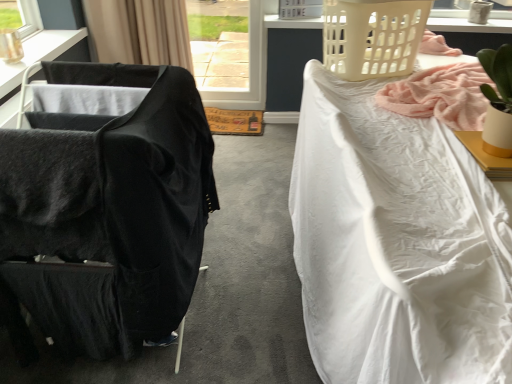
Question: Is the position of black fabric curtain at upper left more distant than that of black fabric chair at left?

Choices:
 (A) yes
 (B) no

Answer: (A)

Question: Is black fabric curtain at upper left to the right of black fabric chair at left from the viewer's perspective?

Choices:
 (A) yes
 (B) no

Answer: (B)

Question: Is black fabric chair at left a part of black fabric curtain at upper left?

Choices:
 (A) yes
 (B) no

Answer: (B)

Question: Is black fabric curtain at upper left wider than black fabric chair at left?

Choices:
 (A) no
 (B) yes

Answer: (A)

Question: Is black fabric curtain at upper left not within black fabric chair at left?

Choices:
 (A) no
 (B) yes

Answer: (B)

Question: Is point (11, 251) closer or farther from the camera than point (466, 147)?

Choices:
 (A) farther
 (B) closer

Answer: (B)

Question: Is black fabric chair at left wider or thinner than white matte desk at upper right?

Choices:
 (A) wide
 (B) thin

Answer: (A)

Question: From a real-world perspective, is black fabric chair at left positioned above or below white matte desk at upper right?

Choices:
 (A) above
 (B) below

Answer: (B)

Question: Visually, is black fabric chair at left positioned to the left or to the right of white matte desk at upper right?

Choices:
 (A) right
 (B) left

Answer: (B)

Question: In terms of size, does white ceramic lamp at upper right, the 2th lamp positioned from the bottom, appear bigger or smaller than black fabric chair at left?

Choices:
 (A) small
 (B) big

Answer: (A)

Question: Is white ceramic lamp at upper right, marked as the first lamp in a right-to-left arrangement, inside the boundaries of black fabric chair at left, or outside?

Choices:
 (A) outside
 (B) inside

Answer: (A)

Question: From a real-world perspective, is white ceramic lamp at upper right, the first lamp viewed from the back, above or below black fabric chair at left?

Choices:
 (A) below
 (B) above

Answer: (B)

Question: In the image, is white ceramic lamp at upper right, the first lamp positioned from the top, positioned in front of or behind black fabric chair at left?

Choices:
 (A) behind
 (B) front

Answer: (A)

Question: Based on their positions, is white ceramic lamp at upper right, the 2th lamp positioned from the bottom, located to the left or right of beige plastic laundry basket at upper right, which appears as the first basket when ordered from the bottom?

Choices:
 (A) left
 (B) right

Answer: (B)

Question: Choose the correct answer: Is white ceramic lamp at upper right, the 2th lamp positioned from the bottom, inside beige plastic laundry basket at upper right, marked as the 2th basket in a back-to-front arrangement, or outside it?

Choices:
 (A) outside
 (B) inside

Answer: (A)